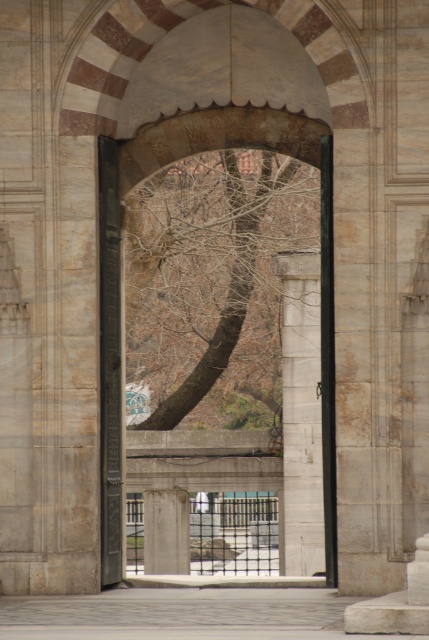
Question: Considering the real-world distances, which object is farthest from the bare wood tree at center?

Choices:
 (A) white stone pillar at center
 (B) white marble pillar at center

Answer: (B)

Question: Is the position of bare wood tree at center less distant than that of white marble pillar at center?

Choices:
 (A) no
 (B) yes

Answer: (B)

Question: Is white stone pillar at center thinner than white marble pillar at center?

Choices:
 (A) yes
 (B) no

Answer: (B)

Question: Estimate the real-world distances between objects in this image. Which object is closer to the bare wood tree at center?

Choices:
 (A) white stone pillar at center
 (B) white marble pillar at center

Answer: (A)

Question: Which object is the farthest from the bare wood tree at center?

Choices:
 (A) white stone pillar at center
 (B) white marble pillar at center

Answer: (B)

Question: Is white stone pillar at center positioned at the back of white marble pillar at center?

Choices:
 (A) yes
 (B) no

Answer: (B)